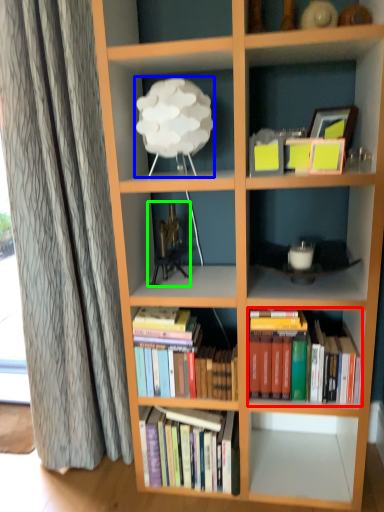
Question: Based on their relative distances, which object is nearer to book (highlighted by a red box)? Choose from lamp (highlighted by a blue box) and toy (highlighted by a green box).

Choices:
 (A) lamp
 (B) toy

Answer: (B)